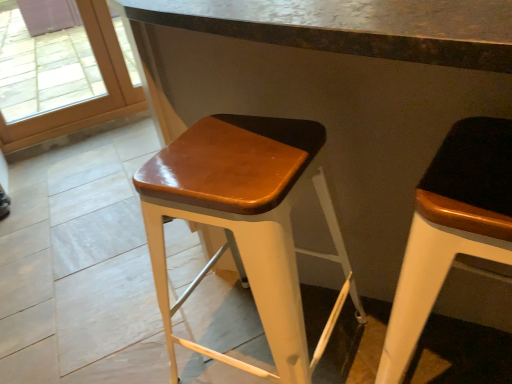
Locate an element on the screen. matte black stool at right, the 1th stool positioned from the right is located at coordinates (451, 228).

Identify the location of transparent glass door at upper left. The height and width of the screenshot is (384, 512). (86, 101).

Locate an element on the screen. Image resolution: width=512 pixels, height=384 pixels. glossy wood stool at center, acting as the second stool starting from the right is located at coordinates (245, 225).

Is point (94, 23) positioned after point (398, 331)?

Yes, it is.

From the transparent glass door at upper left, count 2nd stool to the right and point to it. Please provide its 2D coordinates.

[(451, 228)]

From the picture: Does transparent glass door at upper left lie behind matte black stool at right, which is the second stool from left to right?

Yes, the depth of transparent glass door at upper left is greater than that of matte black stool at right, which is the second stool from left to right.

Is transparent glass door at upper left not close to matte black stool at right, the 1th stool positioned from the right?

transparent glass door at upper left is positioned a significant distance from matte black stool at right, the 1th stool positioned from the right.

Which of these two, matte black stool at right, the 1th stool positioned from the right, or glossy wood stool at center, acting as the second stool starting from the right, stands shorter?

glossy wood stool at center, acting as the second stool starting from the right.

Is matte black stool at right, which is the second stool from left to right, to the left or to the right of glossy wood stool at center, which ranks as the 1th stool in left-to-right order, in the image?

matte black stool at right, which is the second stool from left to right, is positioned on glossy wood stool at center, which ranks as the 1th stool in left-to-right order,'s right side.

Is matte black stool at right, which is the second stool from left to right, positioned behind glossy wood stool at center, acting as the second stool starting from the right?

No.

Is transparent glass door at upper left aimed at glossy wood stool at center, which ranks as the 1th stool in left-to-right order?

Yes, transparent glass door at upper left is facing glossy wood stool at center, which ranks as the 1th stool in left-to-right order.

Looking at this image, how different are the orientations of transparent glass door at upper left and glossy wood stool at center, acting as the second stool starting from the right, in degrees?

The facing directions of transparent glass door at upper left and glossy wood stool at center, acting as the second stool starting from the right, are 126 degrees apart.

What are the coordinates of `the 1st stool in front of the transparent glass door at upper left, counting from the anchor's position` in the screenshot? It's located at (245, 225).

In the image, is transparent glass door at upper left positioned in front of or behind glossy wood stool at center, acting as the second stool starting from the right?

In the image, transparent glass door at upper left appears behind glossy wood stool at center, acting as the second stool starting from the right.

Between glossy wood stool at center, acting as the second stool starting from the right, and matte black stool at right, the 1th stool positioned from the right, which one has more height?

matte black stool at right, the 1th stool positioned from the right.

Is glossy wood stool at center, which ranks as the 1th stool in left-to-right order, positioned far away from matte black stool at right, which is the second stool from left to right?

That's not correct — glossy wood stool at center, which ranks as the 1th stool in left-to-right order, is a little close to matte black stool at right, which is the second stool from left to right.

Is glossy wood stool at center, acting as the second stool starting from the right, located outside matte black stool at right, which is the second stool from left to right?

That's correct, glossy wood stool at center, acting as the second stool starting from the right, is outside of matte black stool at right, which is the second stool from left to right.

Is matte black stool at right, the 1th stool positioned from the right, far from transparent glass door at upper left?

matte black stool at right, the 1th stool positioned from the right, is positioned a significant distance from transparent glass door at upper left.

At what (x,y) coordinates should I click in order to perform the action: click on stool that is the 2nd object to the right of the transparent glass door at upper left, starting at the anchor. Please return your answer as a coordinate pair (x, y). The image size is (512, 384). Looking at the image, I should click on (451, 228).

Is matte black stool at right, which is the second stool from left to right, surrounding transparent glass door at upper left?

No, transparent glass door at upper left is located outside of matte black stool at right, which is the second stool from left to right.

From the image's perspective, is glossy wood stool at center, acting as the second stool starting from the right, on top of transparent glass door at upper left?

Incorrect, from the image's perspective, glossy wood stool at center, acting as the second stool starting from the right, is lower than transparent glass door at upper left.

From a real-world perspective, who is located lower, glossy wood stool at center, acting as the second stool starting from the right, or transparent glass door at upper left?

In real-world perspective, glossy wood stool at center, acting as the second stool starting from the right, is lower.

Is glossy wood stool at center, acting as the second stool starting from the right, directly adjacent to transparent glass door at upper left?

They are not placed beside each other.

Which object is positioned more to the right, glossy wood stool at center, which ranks as the 1th stool in left-to-right order, or transparent glass door at upper left?

glossy wood stool at center, which ranks as the 1th stool in left-to-right order, is more to the right.

Image resolution: width=512 pixels, height=384 pixels. I want to click on glass door on the left of matte black stool at right, the 1th stool positioned from the right, so click(86, 101).

Identify the location of stool below the matte black stool at right, the 1th stool positioned from the right (from a real-world perspective). (245, 225).

Looking at this image, from the image, which object appears to be nearer to transparent glass door at upper left, glossy wood stool at center, which ranks as the 1th stool in left-to-right order, or matte black stool at right, the 1th stool positioned from the right?

Based on the image, glossy wood stool at center, which ranks as the 1th stool in left-to-right order, appears to be nearer to transparent glass door at upper left.

Looking at the image, which one is located closer to matte black stool at right, the 1th stool positioned from the right, transparent glass door at upper left or glossy wood stool at center, acting as the second stool starting from the right?

glossy wood stool at center, acting as the second stool starting from the right, is positioned closer to the anchor matte black stool at right, the 1th stool positioned from the right.

Looking at this image, which object lies nearer to the anchor point transparent glass door at upper left, matte black stool at right, which is the second stool from left to right, or glossy wood stool at center, acting as the second stool starting from the right?

Among the two, glossy wood stool at center, acting as the second stool starting from the right, is located nearer to transparent glass door at upper left.

Looking at the image, which one is located closer to matte black stool at right, the 1th stool positioned from the right, glossy wood stool at center, which ranks as the 1th stool in left-to-right order, or transparent glass door at upper left?

Among the two, glossy wood stool at center, which ranks as the 1th stool in left-to-right order, is located nearer to matte black stool at right, the 1th stool positioned from the right.

Based on the photo, when comparing their distances from glossy wood stool at center, acting as the second stool starting from the right, does transparent glass door at upper left or matte black stool at right, the 1th stool positioned from the right, seem closer?

matte black stool at right, the 1th stool positioned from the right, is positioned closer to the anchor glossy wood stool at center, acting as the second stool starting from the right.

When comparing their distances from glossy wood stool at center, acting as the second stool starting from the right, does matte black stool at right, the 1th stool positioned from the right, or transparent glass door at upper left seem closer?

matte black stool at right, the 1th stool positioned from the right.

Where is `stool between matte black stool at right, which is the second stool from left to right, and transparent glass door at upper left in the front-back direction`? This screenshot has width=512, height=384. stool between matte black stool at right, which is the second stool from left to right, and transparent glass door at upper left in the front-back direction is located at coordinates (245, 225).